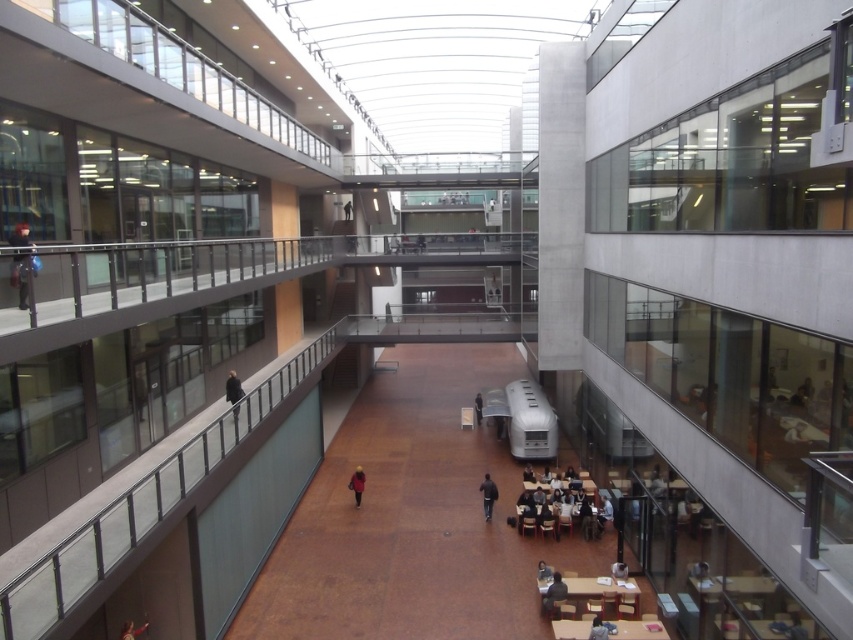
Question: Which point is farther from the camera taking this photo?

Choices:
 (A) (122, 632)
 (B) (358, 484)

Answer: (B)

Question: Can you confirm if red wool coat at center is thinner than dark blue hoodie at lower center?

Choices:
 (A) yes
 (B) no

Answer: (B)

Question: Does black matte jacket at center lie behind dark blue hoodie at lower center?

Choices:
 (A) no
 (B) yes

Answer: (B)

Question: Estimate the real-world distances between objects in this image. Which object is closer to the dark gray coat at left?

Choices:
 (A) black matte jacket at center
 (B) red leather jacket at lower left
 (C) dark blue hoodie at lower center

Answer: (B)

Question: Which object appears farthest from the camera in this image?

Choices:
 (A) red leather jacket at lower left
 (B) black matte jacket at center
 (C) light brown leather jacket at center

Answer: (C)

Question: Is dark blue hoodie at lower center closer to camera compared to red leather jacket at lower left?

Choices:
 (A) no
 (B) yes

Answer: (A)